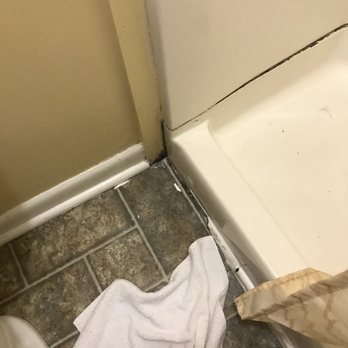
What are the coordinates of `raised portion of shower` in the screenshot? It's located at (221, 176).